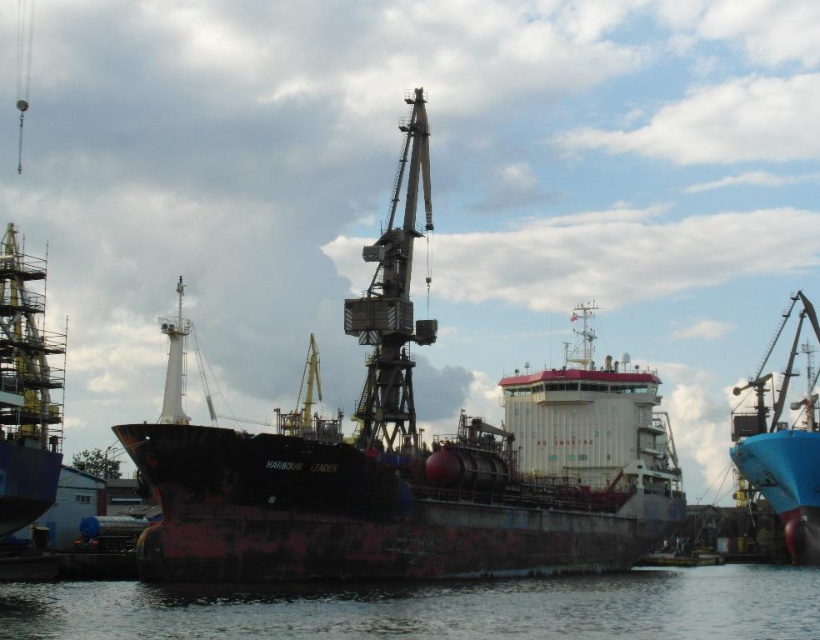
Question: Is rusty metal ship at center bigger than blue matte boat at right?

Choices:
 (A) no
 (B) yes

Answer: (B)

Question: Which is nearer to the rusty metal ship at center?

Choices:
 (A) rusty metal crane at center
 (B) rusty metal ship at left
 (C) blue matte boat at right

Answer: (A)

Question: Does rusty metal ship at center lie in front of rusty metal ship at left?

Choices:
 (A) no
 (B) yes

Answer: (B)

Question: Which is nearer to the clear water at lower center?

Choices:
 (A) blue matte boat at right
 (B) rusty metal crane at center

Answer: (B)

Question: Is rusty metal crane at center above rusty metal ship at left?

Choices:
 (A) no
 (B) yes

Answer: (B)

Question: Which object is closer to the camera taking this photo?

Choices:
 (A) rusty metal crane at center
 (B) rusty metal ship at center
 (C) blue matte boat at right
 (D) clear water at lower center

Answer: (D)